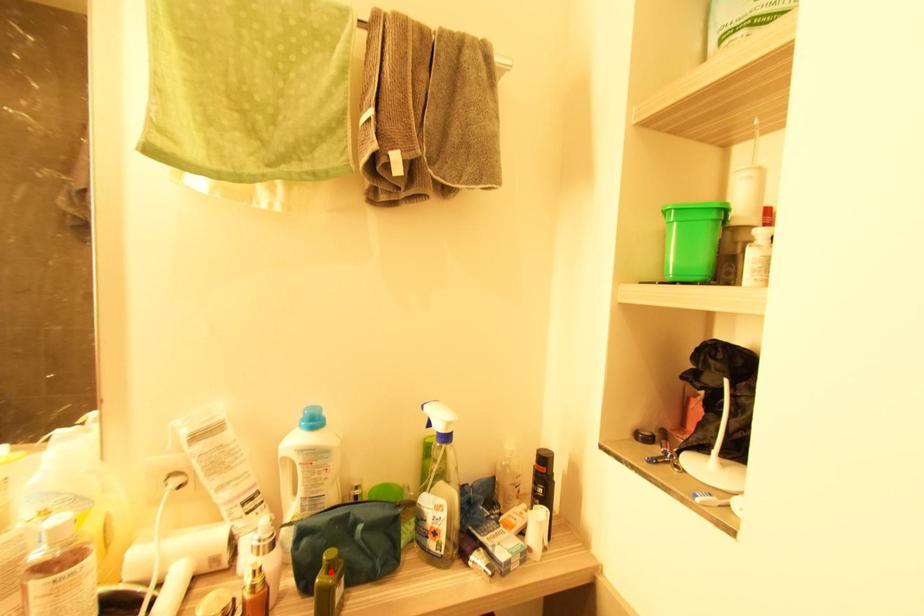
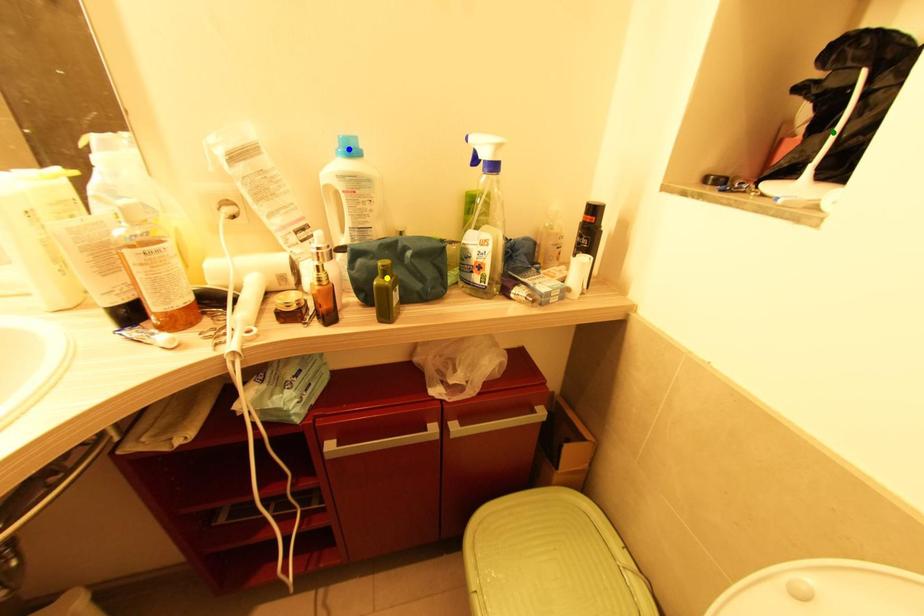
Question: I am providing you with two images of the same scene from different viewpoints. A red point is marked on the first image. You are given multiple points on the second image. Which point in image 2 represents the same 3d spot as the red point in image 1?

Choices:
 (A) blue point
 (B) yellow point
 (C) green point

Answer: (B)